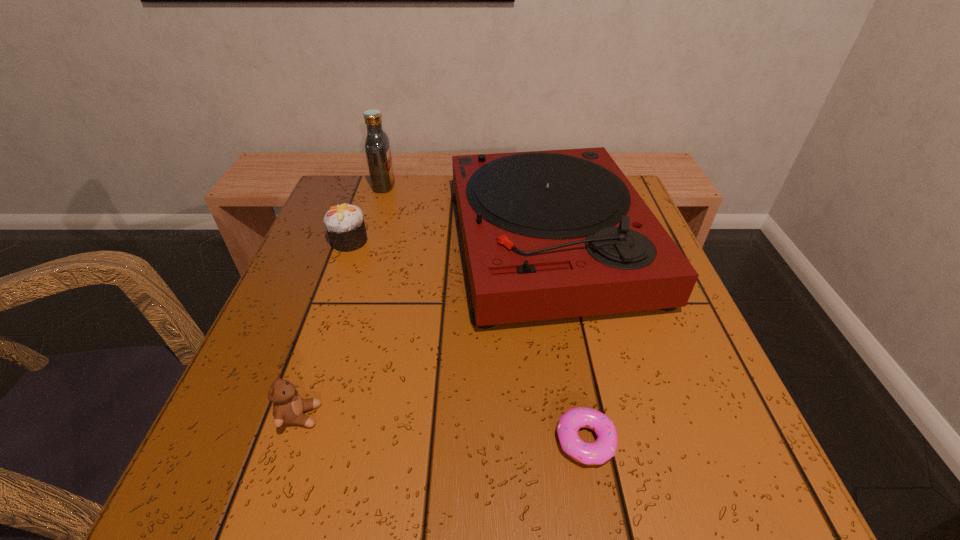
The width and height of the screenshot is (960, 540). What are the coordinates of `the tallest object` in the screenshot? It's located at (377, 146).

At what (x,y) coordinates should I click in order to perform the action: click on record player. Please return your answer as a coordinate pair (x, y). Image resolution: width=960 pixels, height=540 pixels. Looking at the image, I should click on (552, 234).

This screenshot has height=540, width=960. I want to click on teddy bear, so click(x=288, y=407).

Find the location of a particular element. cupcake is located at coordinates (345, 225).

At what (x,y) coordinates should I click in order to perform the action: click on the shortest object. Please return your answer as a coordinate pair (x, y). The width and height of the screenshot is (960, 540). Looking at the image, I should click on (604, 448).

Identify the location of free region located on the front-facing side of the tallest object. The height and width of the screenshot is (540, 960). (433, 185).

What are the coordinates of `blank space located on the left of the second tallest object` in the screenshot? It's located at (420, 243).

At what (x,y) coordinates should I click in order to perform the action: click on blank space located 0.300m on the front-facing side of the teddy bear. Please return your answer as a coordinate pair (x, y). This screenshot has width=960, height=540. Looking at the image, I should click on (523, 416).

Locate an element on the screen. The height and width of the screenshot is (540, 960). free spot located 0.400m on the right of the cupcake is located at coordinates (552, 241).

Identify the location of vacant area situated 0.150m on the right of the doughnut. (722, 441).